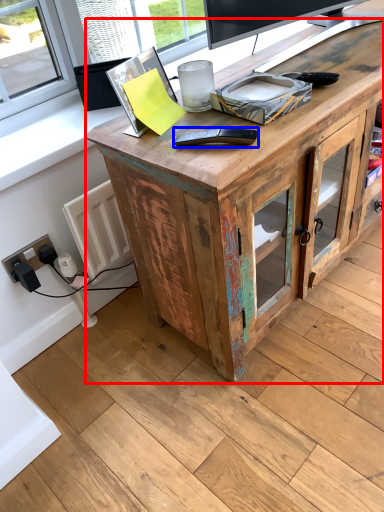
Question: Among these objects, which one is nearest to the camera, desk (highlighted by a red box) or equipment (highlighted by a blue box)?

Choices:
 (A) desk
 (B) equipment

Answer: (A)